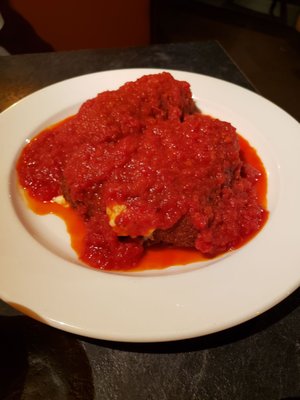
Identify the location of wall. (258, 7).